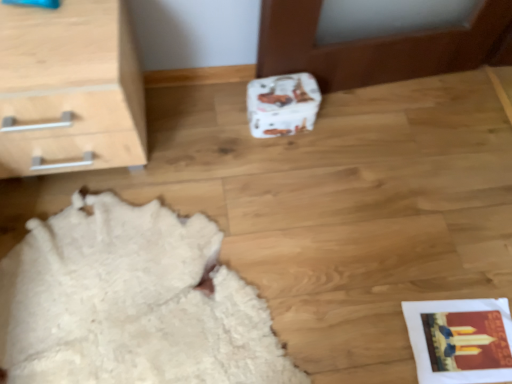
At what (x,y) coordinates should I click in order to perform the action: click on empty space that is in between white fluffy rug at lower left and white paper shoe box at center. Please return your answer as a coordinate pair (x, y). This screenshot has width=512, height=384. Looking at the image, I should click on 268,189.